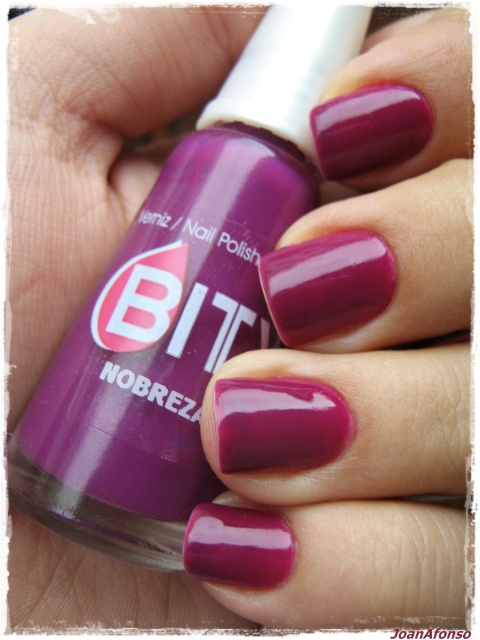
Is point (342, 154) farther from camera compared to point (24, 486)?

Yes.

Find the location of `glossy nail polish at center`. glossy nail polish at center is located at coordinates (357, 362).

Is point (441, 474) positioned behind point (50, 384)?

No, it is in front of (50, 384).

Identify the location of glossy nail polish at center. (357, 362).

Does glossy nail polish at center appear under satin purple nail polish at center?

No.

Is glossy nail polish at center to the left of satin purple nail polish at center from the viewer's perspective?

In fact, glossy nail polish at center is to the right of satin purple nail polish at center.

Consider the image. Who is more forward, (x=247, y=486) or (x=292, y=541)?

Point (x=292, y=541) is more forward.

This screenshot has height=640, width=480. In order to click on glossy nail polish at center in this screenshot , I will do `click(357, 362)`.

Can you confirm if matte purple nail polish at center is positioned above satin purple nail polish at center?

Yes, matte purple nail polish at center is above satin purple nail polish at center.

Does matte purple nail polish at center appear under satin purple nail polish at center?

Incorrect, matte purple nail polish at center is not positioned below satin purple nail polish at center.

Does point (227, 257) come closer to viewer compared to point (210, 509)?

No, (227, 257) is further to viewer.

Identify the location of matte purple nail polish at center. The height and width of the screenshot is (640, 480). (179, 305).